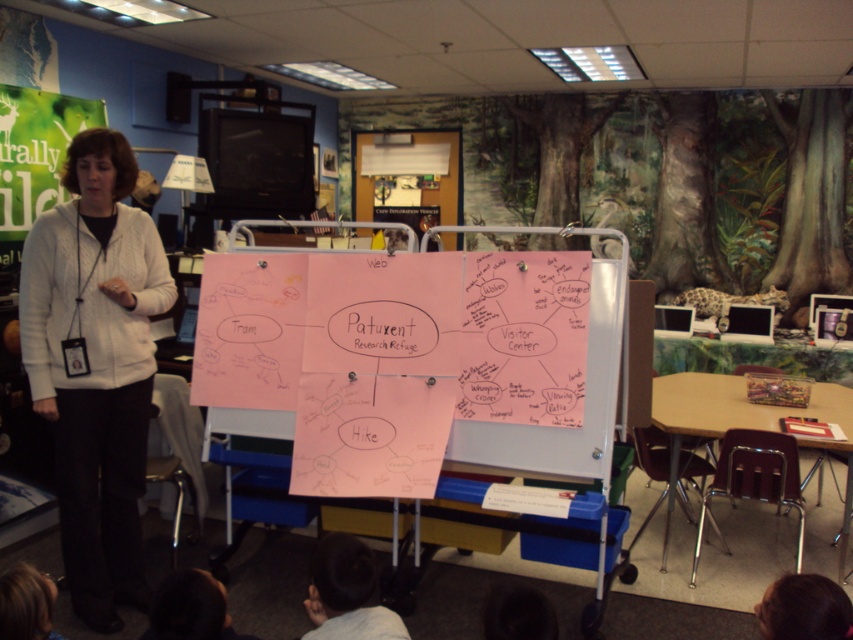
Who is higher up, pink paper at center or dark hair at lower center?

pink paper at center is above.

Which is below, pink paper at center or dark hair at lower center?

dark hair at lower center is below.

Is point (569, 432) positioned in front of point (305, 604)?

No, it is not.

Where is `pink paper at center`? pink paper at center is located at coordinates (556, 428).

This screenshot has width=853, height=640. Identify the location of white zip-up sweater at left. (96, 365).

What do you see at coordinates (96, 365) in the screenshot?
I see `white zip-up sweater at left` at bounding box center [96, 365].

This screenshot has height=640, width=853. I want to click on white zip-up sweater at left, so click(x=96, y=365).

Which is below, white zip-up sweater at left or dark hair at lower center?

Positioned lower is dark hair at lower center.

Between point (22, 282) and point (357, 612), which one is positioned in front?

Positioned in front is point (357, 612).

Image resolution: width=853 pixels, height=640 pixels. I want to click on white zip-up sweater at left, so click(96, 365).